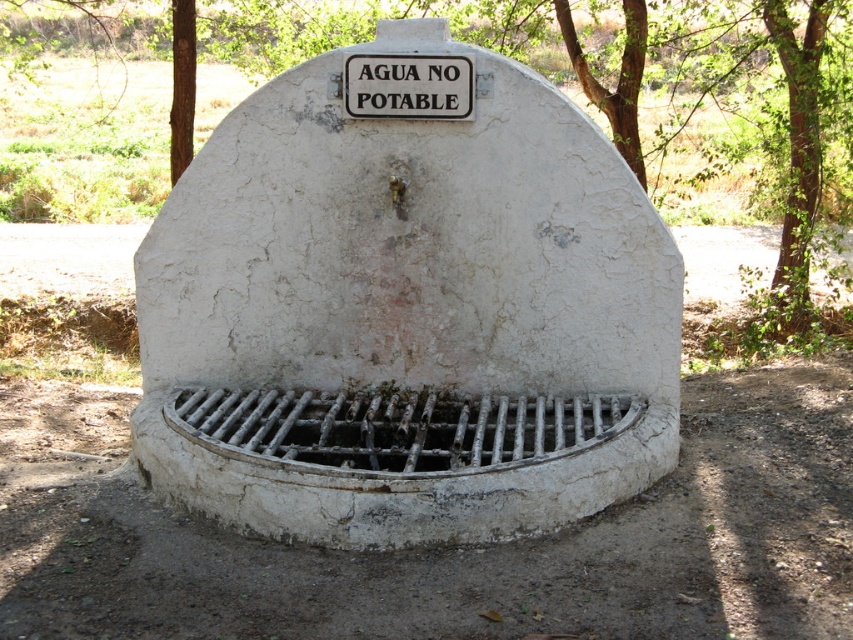
Does green leafy tree at upper center appear on the right side of rusty metal grate at center?

No, green leafy tree at upper center is not to the right of rusty metal grate at center.

Does green leafy tree at upper center lie behind rusty metal grate at center?

Yes.

Find the location of `green leafy tree at upper center`. green leafy tree at upper center is located at coordinates (654, 104).

What are the coordinates of `green leafy tree at upper center` in the screenshot? It's located at (654, 104).

Can you confirm if green leafy tree at upper center is positioned above white plastic sign at upper center?

Indeed, green leafy tree at upper center is positioned over white plastic sign at upper center.

Does point (743, 93) come behind point (364, 58)?

Yes, it is.

Between point (837, 45) and point (386, 93), which one is positioned behind?

The point (837, 45) is more distant.

Identify the location of green leafy tree at upper center. (654, 104).

Is rusty metal grate at center taller than white plastic sign at upper center?

Yes.

Image resolution: width=853 pixels, height=640 pixels. Describe the element at coordinates (399, 426) in the screenshot. I see `rusty metal grate at center` at that location.

Who is more distant from viewer, (643, 406) or (444, 113)?

The point (643, 406) is behind.

The width and height of the screenshot is (853, 640). I want to click on rusty metal grate at center, so click(x=399, y=426).